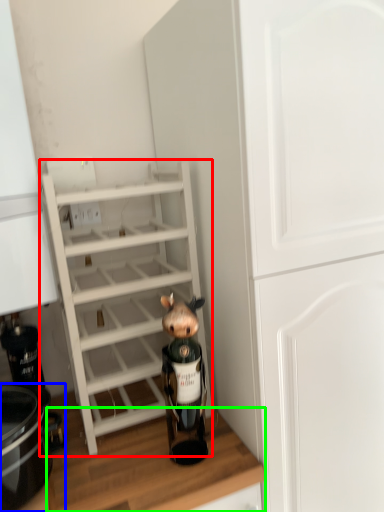
Question: Considering the real-world distances, which object is closest to shelf (highlighted by a red box)? crock pot (highlighted by a blue box) or counter top (highlighted by a green box).

Choices:
 (A) crock pot
 (B) counter top

Answer: (B)